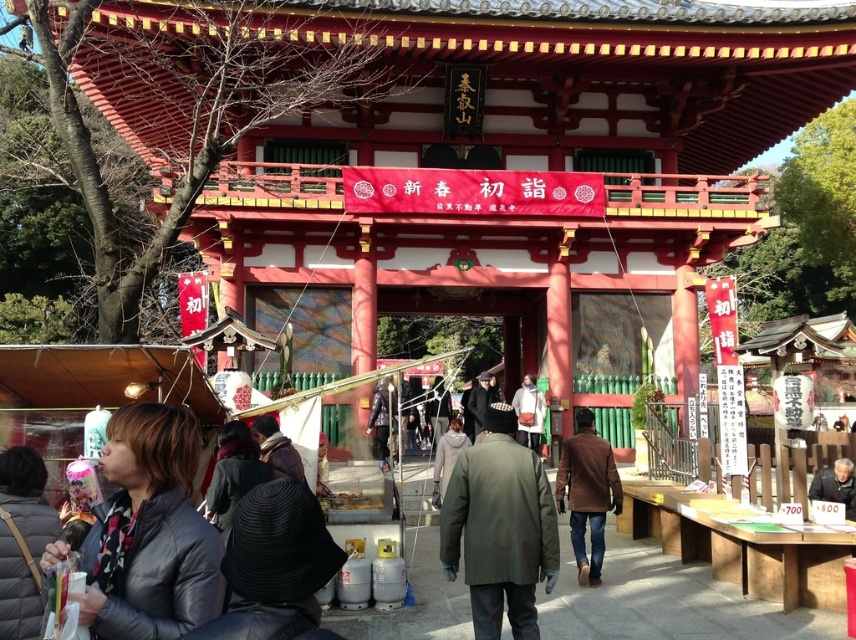
Question: Which point is closer to the camera?

Choices:
 (A) (610, 467)
 (B) (85, 596)
 (C) (833, 483)
 (D) (526, 404)

Answer: (B)

Question: Is green matte coat at center in front of brown leather jacket at center?

Choices:
 (A) yes
 (B) no

Answer: (A)

Question: Which point is farther to the camera?

Choices:
 (A) (528, 378)
 (B) (441, 538)
 (C) (580, 529)

Answer: (A)

Question: Considering the relative positions of leather jacket at lower left and brown leather jacket at center in the image provided, where is leather jacket at lower left located with respect to brown leather jacket at center?

Choices:
 (A) right
 (B) left

Answer: (B)

Question: In this image, where is brown leather jacket at center located relative to white fabric bag at center?

Choices:
 (A) right
 (B) left

Answer: (A)

Question: Which point is farther to the camera?

Choices:
 (A) green matte coat at center
 (B) brown leather jacket at center
 (C) leather jacket at lower left
 (D) white fabric bag at center

Answer: (D)